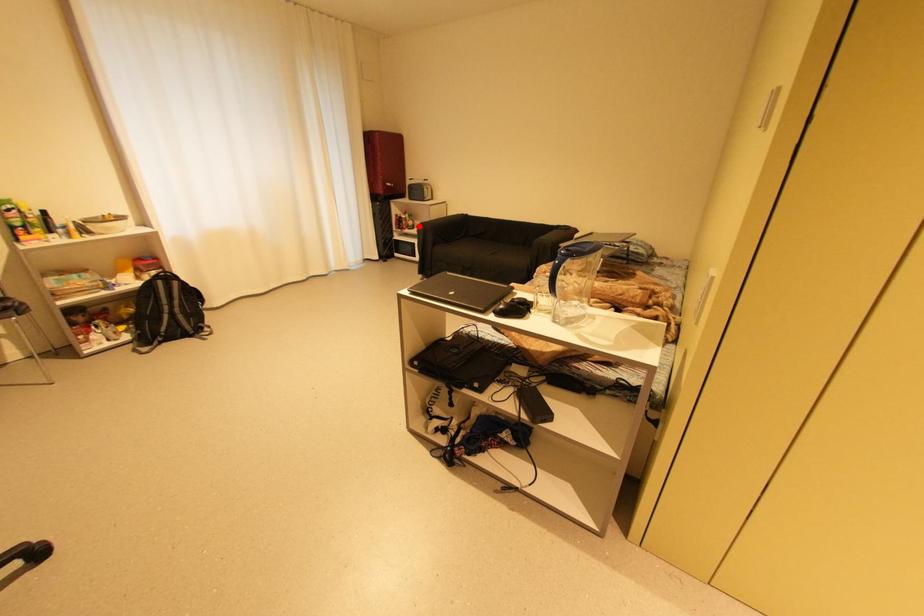
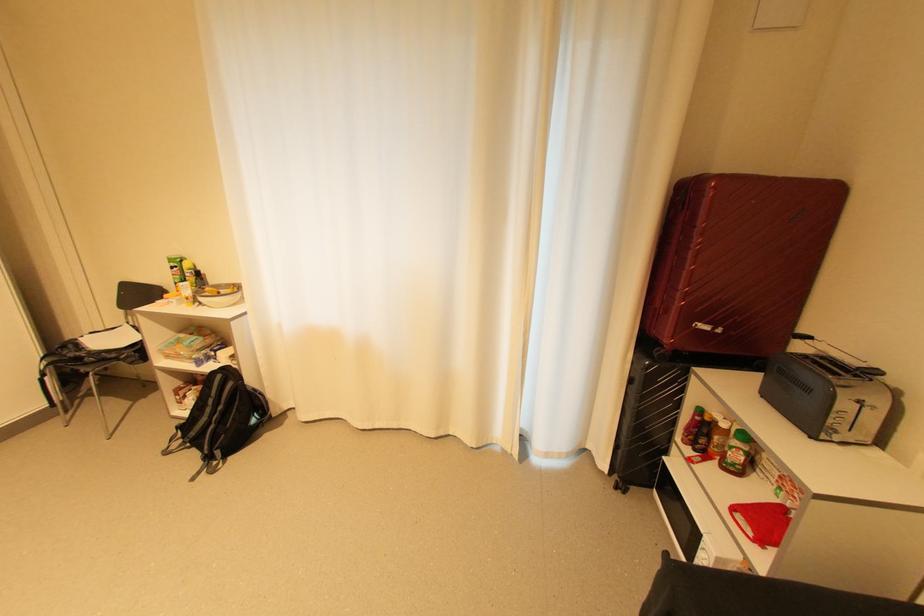
The point at the highlighted location is marked in the first image. Where is the corresponding point in the second image?

(739, 466)